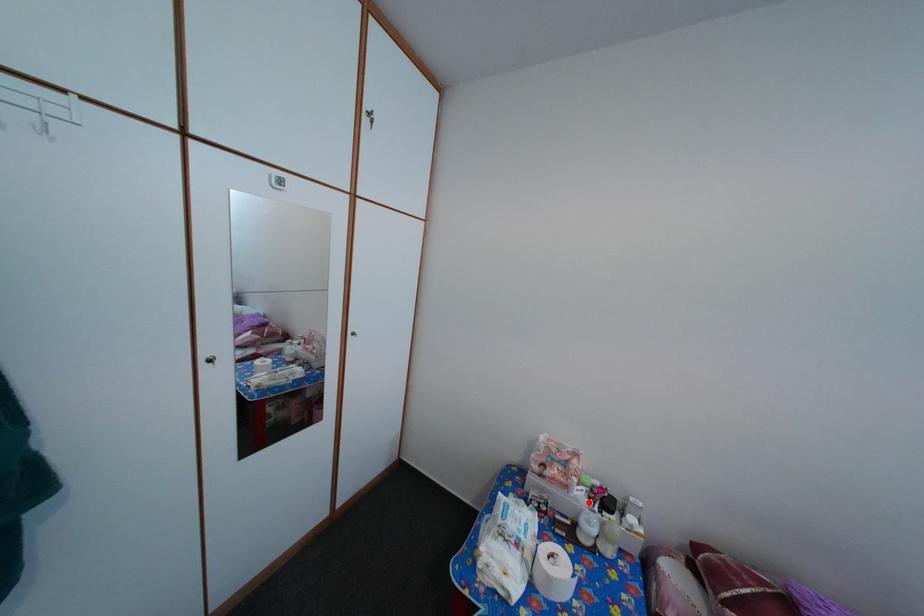
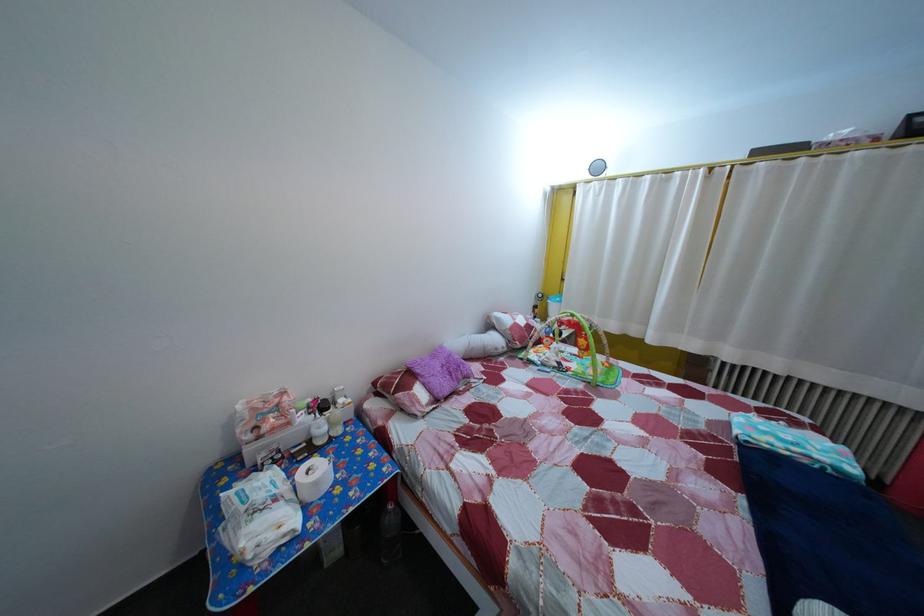
Where in the second image is the point corresponding to the highlighted location from the first image?

(311, 427)